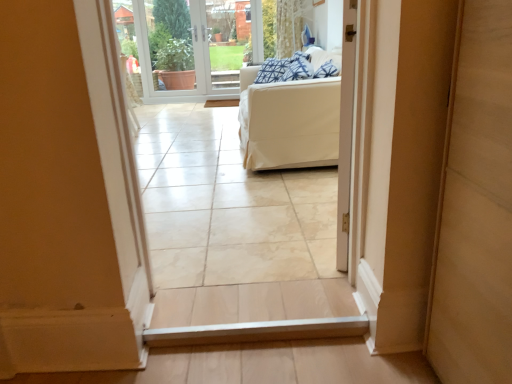
Question: Considering their positions, is blue patterned pillow at upper center located in front of or behind transparent glass door at center?

Choices:
 (A) front
 (B) behind

Answer: (A)

Question: Considering the positions of blue patterned pillow at upper center and transparent glass door at center in the image, is blue patterned pillow at upper center wider or thinner than transparent glass door at center?

Choices:
 (A) wide
 (B) thin

Answer: (A)

Question: Estimate the real-world distances between objects in this image. Which object is farther from the white plastic window screen at upper center?

Choices:
 (A) transparent glass door at center
 (B) blue patterned pillow at upper center
 (C) white fabric couch at center

Answer: (C)

Question: Considering the real-world distances, which object is farthest from the white fabric couch at center?

Choices:
 (A) transparent glass door at center
 (B) white plastic window screen at upper center
 (C) blue patterned pillow at upper center

Answer: (B)